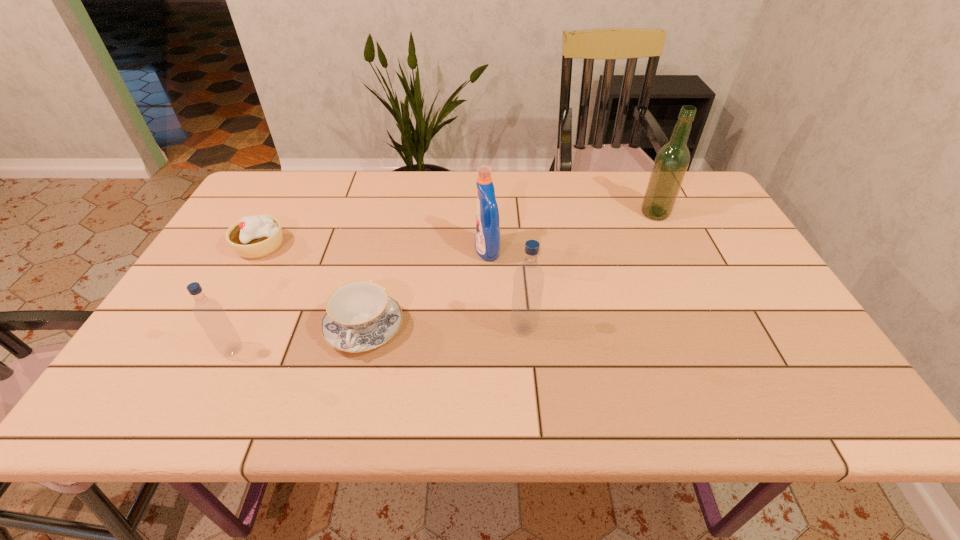
Identify the location of vacant region that satisfies the following two spatial constraints: 1. on the back side of the right water bottle; 2. on the right side of the fourth tallest object. (244, 328).

Identify the location of free spot that satisfies the following two spatial constraints: 1. on the label of the taller water bottle; 2. on the left side of the third object from right to left. Image resolution: width=960 pixels, height=540 pixels. (489, 328).

Identify the location of free space that satisfies the following two spatial constraints: 1. on the label of the second object from right to left; 2. on the left side of the detergent. (489, 328).

What are the coordinates of `vacant position in the image that satisfies the following two spatial constraints: 1. on the front side of the whipped cream; 2. on the left side of the shorter water bottle` in the screenshot? It's located at (203, 351).